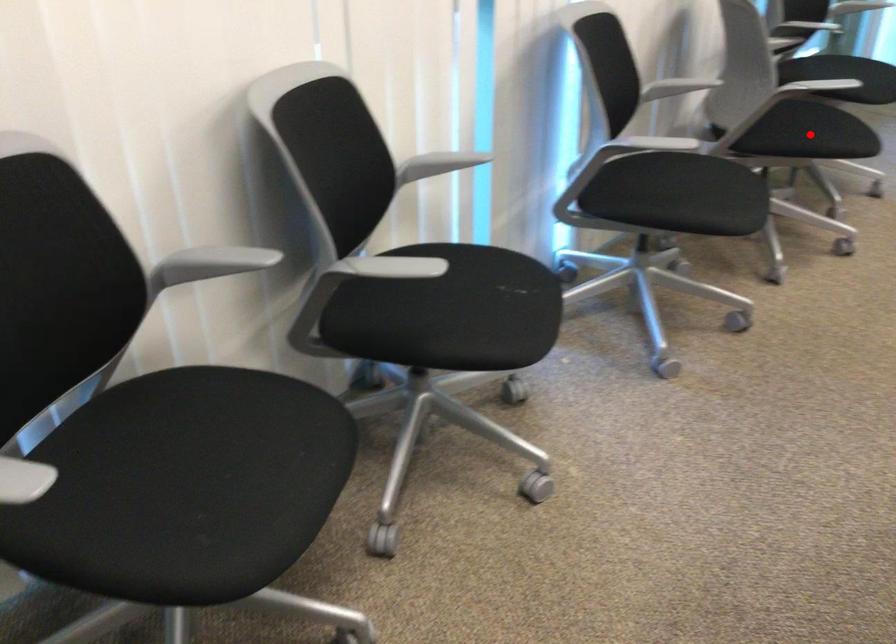
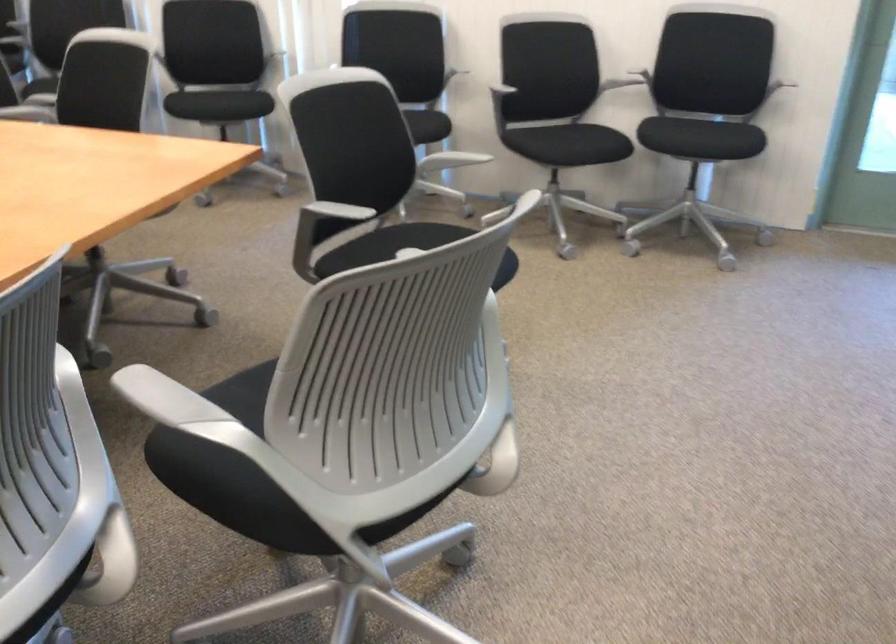
Question: I am providing you with two images of the same scene from different viewpoints. A red point is marked on the first image. At the location where the point appears in image 1, is it still visible in image 2?

Choices:
 (A) Yes
 (B) No

Answer: (B)